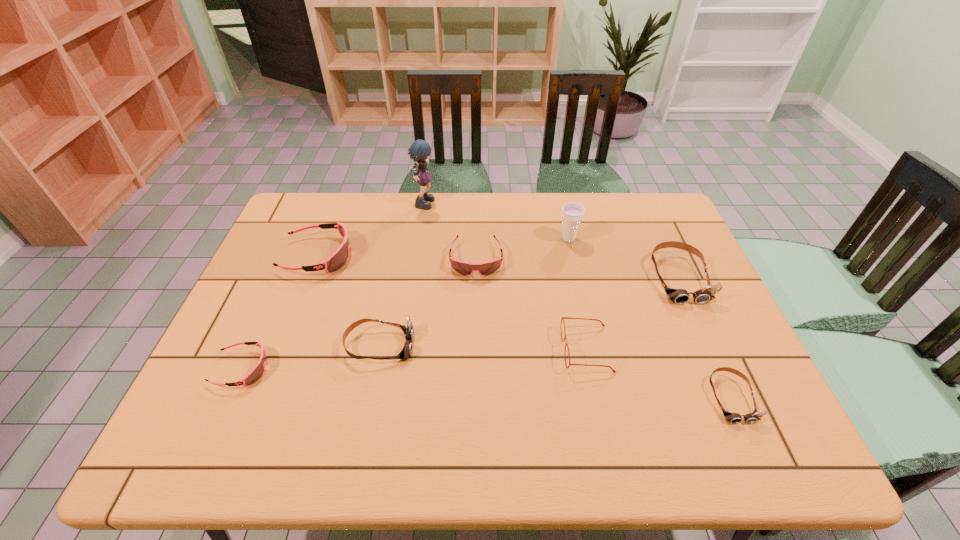
Identify which pink goggles is the second nearest to the purple cup. Please provide its 2D coordinates. Your answer should be formatted as a tuple, i.e. [(x, y)], where the tuple contains the x and y coordinates of a point satisfying the conditions above.

[(335, 261)]

Locate an element on the screen. This screenshot has height=540, width=960. brown goggles that stands as the second closest to the smallest pink goggles is located at coordinates (680, 296).

Locate an element on the screen. This screenshot has width=960, height=540. brown goggles identified as the third closest to the fourth goggles from left to right is located at coordinates (734, 418).